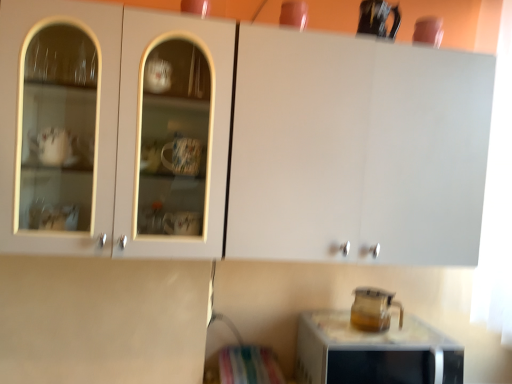
Question: In the image, is matte white cabinet at upper center on the left side or the right side of transparent glass pitcher at lower right?

Choices:
 (A) right
 (B) left

Answer: (B)

Question: In terms of height, does matte white cabinet at upper center look taller or shorter compared to transparent glass pitcher at lower right?

Choices:
 (A) short
 (B) tall

Answer: (B)

Question: Which of these objects is positioned closest to the matte white cabinet at upper center?

Choices:
 (A) transparent glass pitcher at lower right
 (B) transparent glass pitcher at lower right

Answer: (A)

Question: Based on their relative distances, which object is nearer to the matte white cabinet at upper center?

Choices:
 (A) transparent glass pitcher at lower right
 (B) transparent glass pitcher at lower right

Answer: (A)